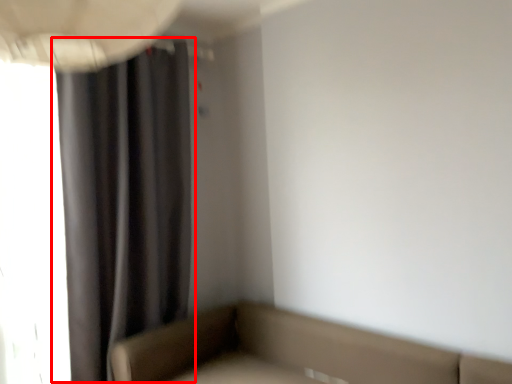
Question: From the image's perspective, what is the correct spatial relationship of curtain (annotated by the red box) in relation to studio couch?

Choices:
 (A) above
 (B) below

Answer: (A)